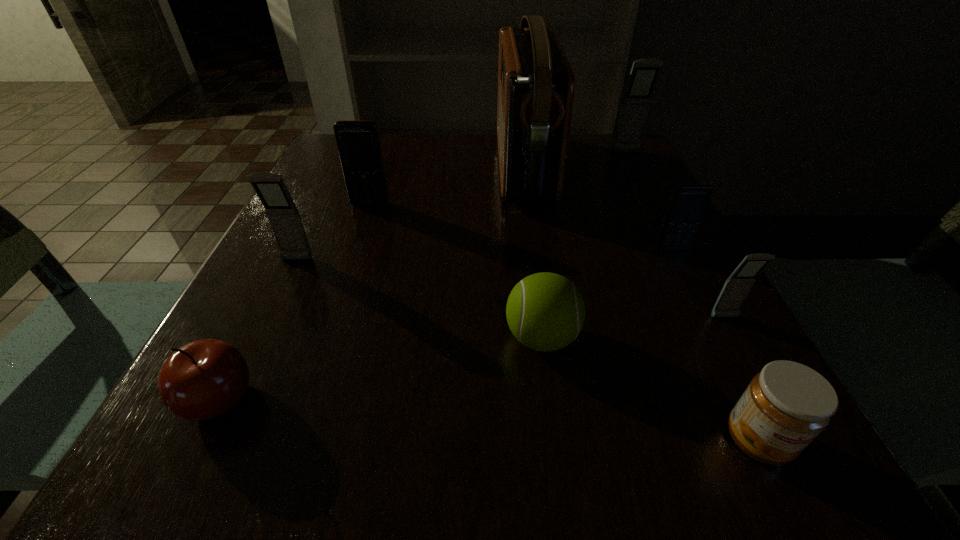
This screenshot has width=960, height=540. Identify the location of vacant space located on the screen of the smaller orange cellular telephone. (720, 341).

I want to click on free space located on the front-facing side of the nearest gray cellular telephone, so click(x=809, y=471).

Image resolution: width=960 pixels, height=540 pixels. I want to click on free region located 0.090m on the back of the green tennis ball, so click(x=533, y=273).

The width and height of the screenshot is (960, 540). Identify the location of blank area located on the back of the apple. (307, 224).

Identify the location of radio receiver at the far edge. (536, 84).

You are a GUI agent. You are given a task and a screenshot of the screen. Output one action in this format:
    pyautogui.click(x=<x>, y=<y>)
    Task: Click on the cellular telephone that is at the far edge
    
    Given the screenshot: What is the action you would take?
    pyautogui.click(x=644, y=74)

You are a GUI agent. You are given a task and a screenshot of the screen. Output one action in this format:
    pyautogui.click(x=<x>, y=<y>)
    Task: Click on the apple present at the near edge
    
    Given the screenshot: What is the action you would take?
    pyautogui.click(x=204, y=379)

Locate an element on the screen. The image size is (960, 540). jam at the near edge is located at coordinates (787, 405).

Where is `apple positioned at the left edge`? apple positioned at the left edge is located at coordinates (204, 379).

This screenshot has width=960, height=540. Find the location of `jam at the right edge`. jam at the right edge is located at coordinates (787, 405).